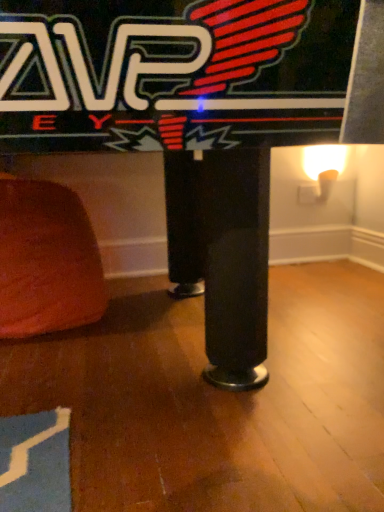
Image resolution: width=384 pixels, height=512 pixels. In order to click on free space in front of matte brown ottoman at lower left in this screenshot , I will do `click(82, 388)`.